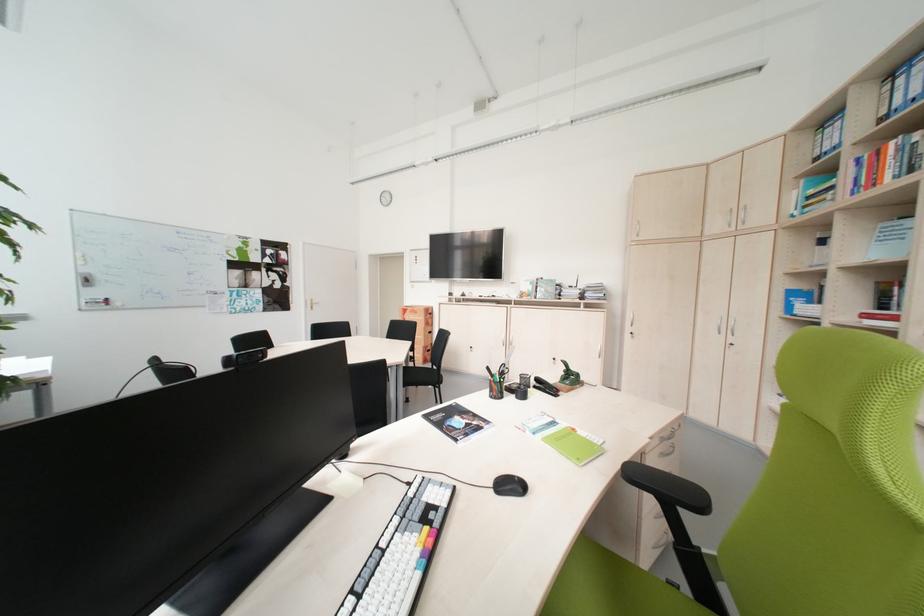
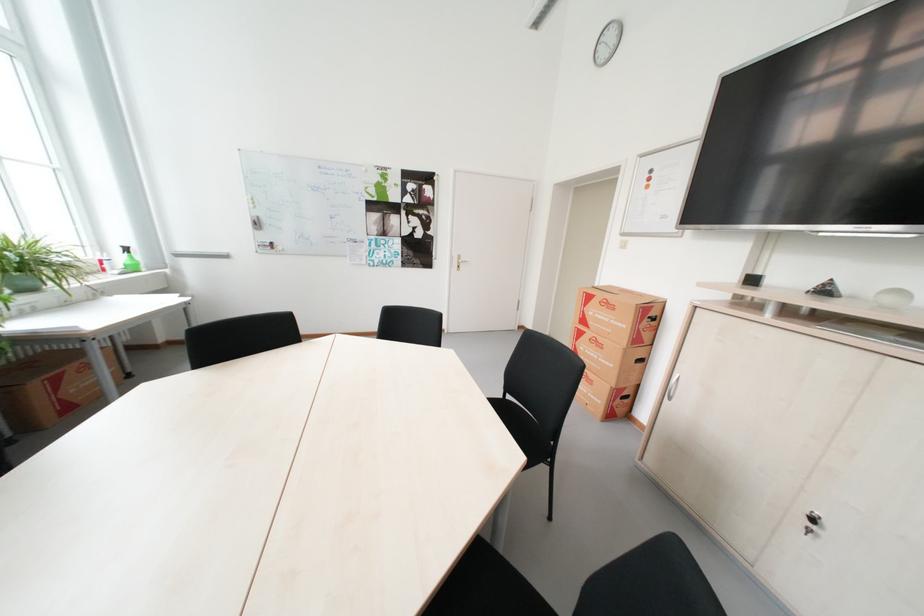
Find the pixel in the second image that matches point 473,296 in the first image.

(835, 292)